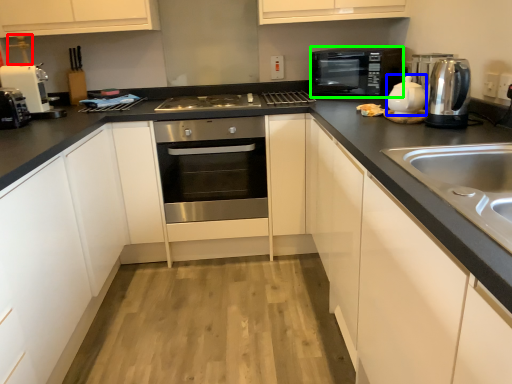
Question: Considering the real-world distances, which object is farthest from faucet (highlighted by a red box)? tea pot (highlighted by a blue box) or home appliance (highlighted by a green box)?

Choices:
 (A) tea pot
 (B) home appliance

Answer: (A)